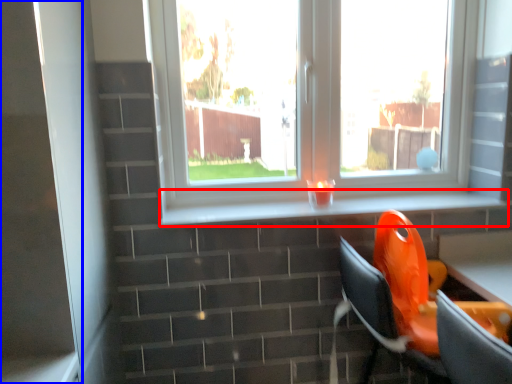
Question: Which object appears closest to the camera in this image, window sill (highlighted by a red box) or screen door (highlighted by a blue box)?

Choices:
 (A) window sill
 (B) screen door

Answer: (B)